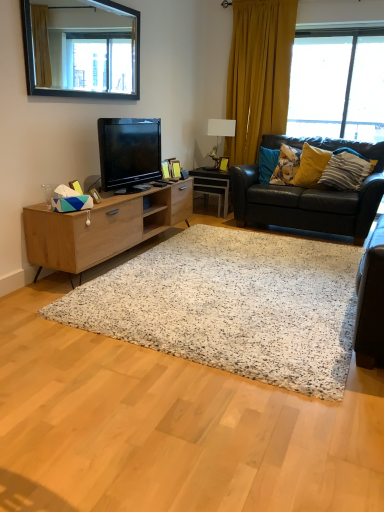
Question: Is white speckled rug at center taller or shorter than black leather couch at right?

Choices:
 (A) tall
 (B) short

Answer: (B)

Question: Looking at the image, does white speckled rug at center seem bigger or smaller compared to black leather couch at right?

Choices:
 (A) big
 (B) small

Answer: (B)

Question: Based on their relative distances, which object is nearer to the transparent glass window at upper right?

Choices:
 (A) matte black tv at left
 (B) black leather couch at right
 (C) yellow fabric pillow at right, the 2th pillow positioned from the right
 (D) white ceramic lamp at upper center
 (E) white glossy desk at center

Answer: (B)

Question: Estimate the real-world distances between objects in this image. Which object is closer to the white glossy desk at center?

Choices:
 (A) yellow velvet curtain at upper right
 (B) matte black tv at left
 (C) wooden picture frame at center
 (D) black leather couch at right
 (E) white speckled rug at center

Answer: (C)